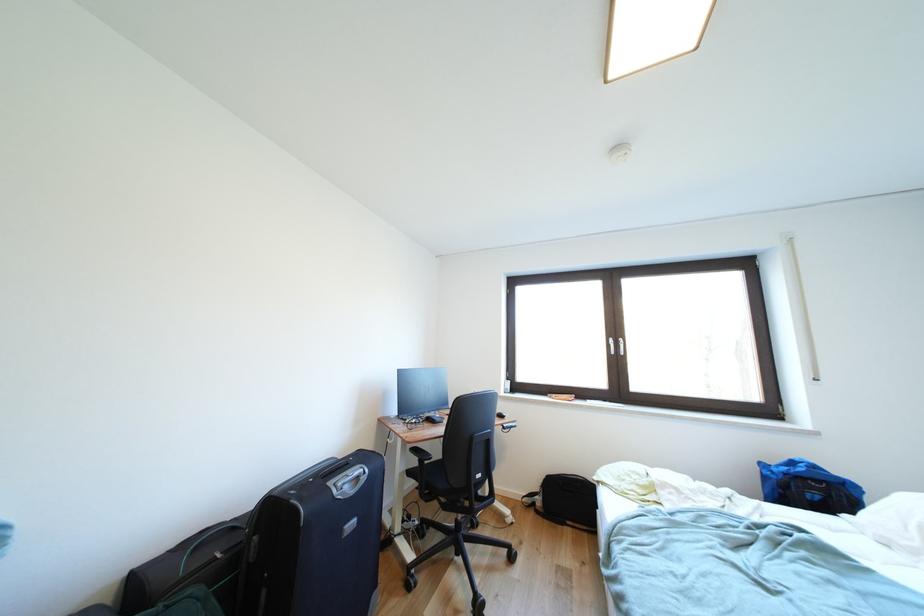
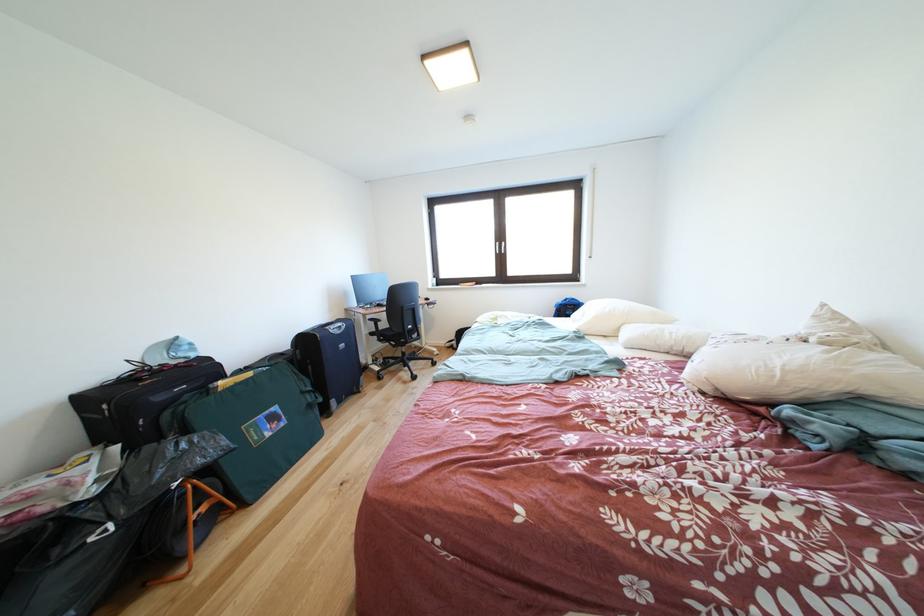
The point at (418, 477) is marked in the first image. Where is the corresponding point in the second image?

(380, 339)